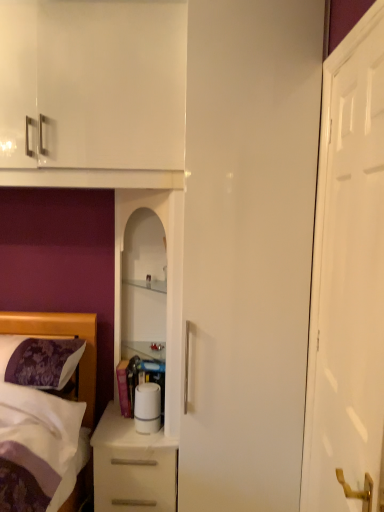
Question: Considering the relative sizes of white glossy cabinet at center and white glossy door at right in the image provided, is white glossy cabinet at center wider than white glossy door at right?

Choices:
 (A) yes
 (B) no

Answer: (A)

Question: Could white glossy door at right be considered to be inside white glossy cabinet at center?

Choices:
 (A) no
 (B) yes

Answer: (A)

Question: Is white glossy cabinet at center aimed at white glossy door at right?

Choices:
 (A) no
 (B) yes

Answer: (A)

Question: Can you confirm if white glossy cabinet at center is positioned to the left of white glossy door at right?

Choices:
 (A) no
 (B) yes

Answer: (B)

Question: From the image's perspective, is white glossy cabinet at center over white glossy door at right?

Choices:
 (A) yes
 (B) no

Answer: (B)

Question: Is white glossy cabinet at center inside the boundaries of white glossy door at right, or outside?

Choices:
 (A) inside
 (B) outside

Answer: (B)

Question: From their relative heights in the image, would you say white glossy cabinet at center is taller or shorter than white glossy door at right?

Choices:
 (A) short
 (B) tall

Answer: (A)

Question: Is white glossy cabinet at center wider or thinner than white glossy door at right?

Choices:
 (A) thin
 (B) wide

Answer: (B)

Question: From a real-world perspective, relative to white glossy door at right, is white glossy cabinet at center vertically above or below?

Choices:
 (A) below
 (B) above

Answer: (A)

Question: From the image's perspective, is white glossy cabinet at center located above or below white matte chest of drawers at lower left?

Choices:
 (A) above
 (B) below

Answer: (A)

Question: Relative to white matte chest of drawers at lower left, is white glossy cabinet at center in front or behind?

Choices:
 (A) front
 (B) behind

Answer: (A)

Question: Is white glossy cabinet at center to the left or to the right of white matte chest of drawers at lower left in the image?

Choices:
 (A) left
 (B) right

Answer: (B)

Question: Would you say white glossy cabinet at center is inside or outside white matte chest of drawers at lower left?

Choices:
 (A) outside
 (B) inside

Answer: (A)

Question: Considering the positions of point (377, 131) and point (139, 201), is point (377, 131) closer or farther from the camera than point (139, 201)?

Choices:
 (A) closer
 (B) farther

Answer: (A)

Question: From their relative heights in the image, would you say white glossy door at right is taller or shorter than white glossy cabinet at center?

Choices:
 (A) short
 (B) tall

Answer: (B)